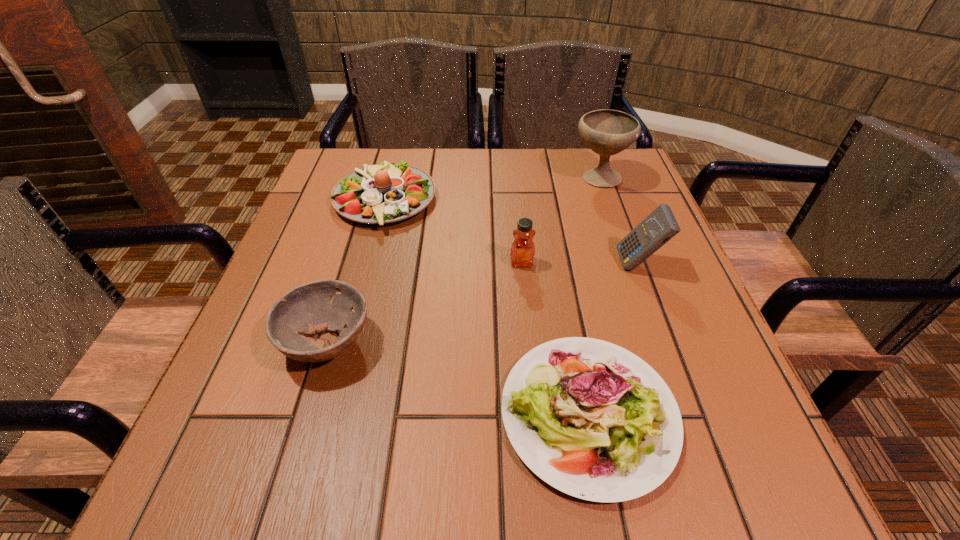
The width and height of the screenshot is (960, 540). Identify the location of vacant space located on the front-facing side of the calculator. (593, 264).

Locate an element on the screen. Image resolution: width=960 pixels, height=540 pixels. free space located 0.090m on the front-facing side of the calculator is located at coordinates (574, 264).

Where is `free space located on the front label of the third tallest object`? free space located on the front label of the third tallest object is located at coordinates (536, 411).

I want to click on vacant space located on the right of the bowl, so click(591, 342).

Identify the location of vacant space situated on the front of the left salad plate. The width and height of the screenshot is (960, 540). (356, 308).

Find the location of a particular element. vacant point located on the left of the shortest object is located at coordinates (390, 414).

The width and height of the screenshot is (960, 540). Identify the location of chalice that is at the far edge. (607, 132).

I want to click on salad plate at the far edge, so click(x=387, y=192).

Image resolution: width=960 pixels, height=540 pixels. I want to click on object situated at the near edge, so click(590, 418).

Where is `bowl at the left edge`? bowl at the left edge is located at coordinates (318, 306).